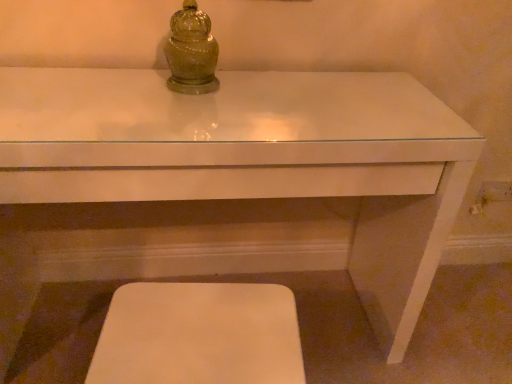
At what (x,y) coordinates should I click in order to perform the action: click on free spot above white matte step stool at lower center (from a real-world perspective). Please return your answer as a coordinate pair (x, y). The width and height of the screenshot is (512, 384). Looking at the image, I should click on (201, 330).